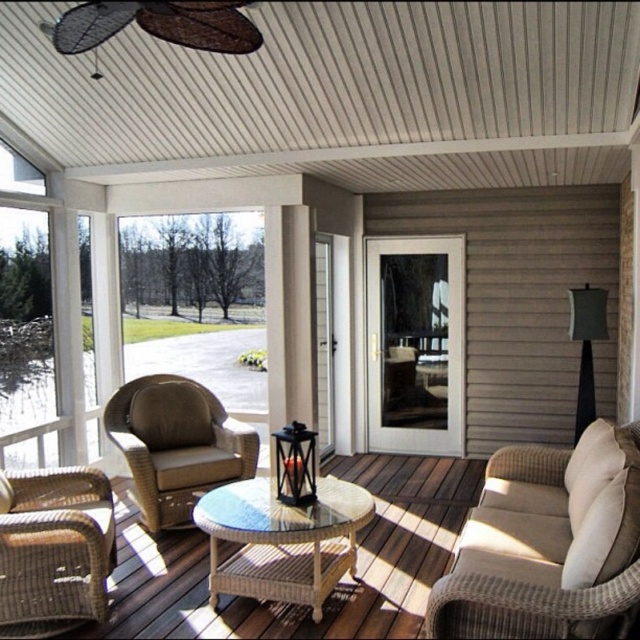
Image resolution: width=640 pixels, height=640 pixels. Describe the element at coordinates (337, 586) in the screenshot. I see `woven rattan couch at center` at that location.

Which is more to the left, woven rattan couch at center or woven rattan coffee table at center?

woven rattan coffee table at center

Find the location of a particular element. The width and height of the screenshot is (640, 640). woven rattan couch at center is located at coordinates (337, 586).

Who is higher up, woven rattan coffee table at center or brown wicker rocking chair at left?

brown wicker rocking chair at left is higher up.

I want to click on woven rattan coffee table at center, so click(282, 540).

Is beige woven armchair at lower right below woven rattan coffee table at center?

No.

Who is shorter, beige woven armchair at lower right or woven rattan coffee table at center?

With less height is woven rattan coffee table at center.

Is point (464, 576) behind point (212, 561)?

That is False.

I want to click on beige woven armchair at lower right, so click(x=547, y=544).